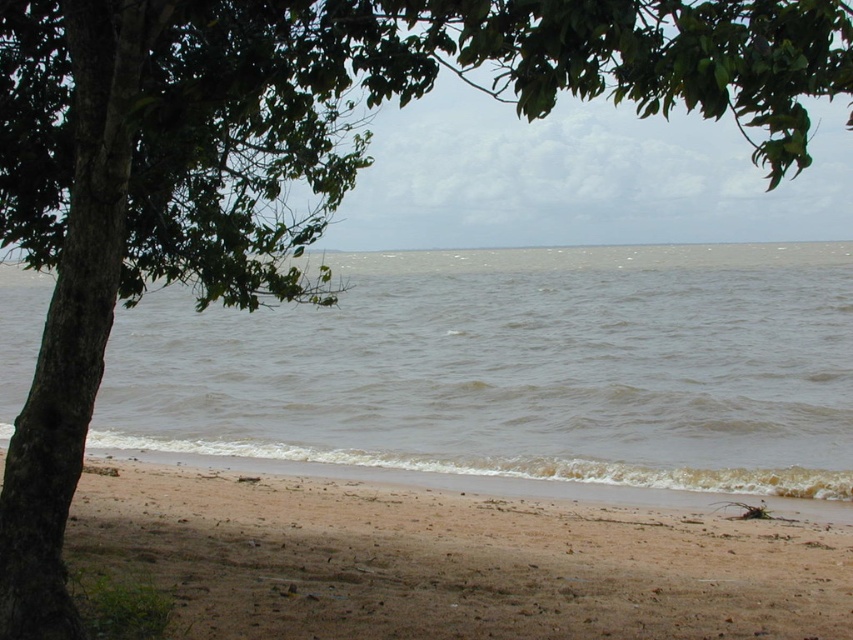
Question: Can you confirm if brown water at lower center is wider than brown sandy beach at lower center?

Choices:
 (A) yes
 (B) no

Answer: (A)

Question: Is brown water at lower center bigger than brown sandy beach at lower center?

Choices:
 (A) no
 (B) yes

Answer: (B)

Question: Which object is farther from the camera taking this photo?

Choices:
 (A) brown water at lower center
 (B) brown sandy beach at lower center

Answer: (A)

Question: Can you confirm if brown water at lower center is positioned above brown sandy beach at lower center?

Choices:
 (A) no
 (B) yes

Answer: (B)

Question: Which point is closer to the camera taking this photo?

Choices:
 (A) (616, 394)
 (B) (498, 576)

Answer: (B)